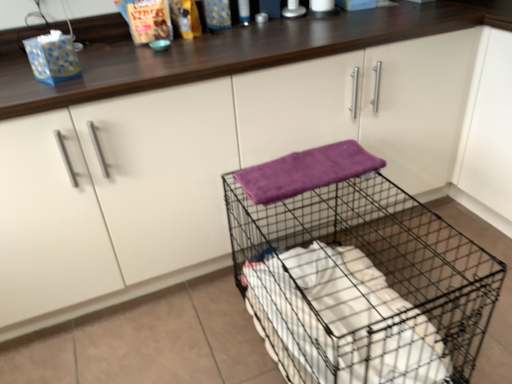
Question: Is the depth of purple soft towel at center greater than that of black wire mesh trolley at center?

Choices:
 (A) yes
 (B) no

Answer: (A)

Question: Is purple soft towel at center located outside black wire mesh trolley at center?

Choices:
 (A) no
 (B) yes

Answer: (B)

Question: From the image's perspective, would you say purple soft towel at center is shown under black wire mesh trolley at center?

Choices:
 (A) no
 (B) yes

Answer: (A)

Question: Is purple soft towel at center in front of black wire mesh trolley at center?

Choices:
 (A) no
 (B) yes

Answer: (A)

Question: Are purple soft towel at center and black wire mesh trolley at center located far from each other?

Choices:
 (A) yes
 (B) no

Answer: (B)

Question: Is black wire mesh trolley at center completely or partially inside purple soft towel at center?

Choices:
 (A) yes
 (B) no

Answer: (B)

Question: Can you confirm if black wire mesh trolley at center is shorter than purple soft towel at center?

Choices:
 (A) yes
 (B) no

Answer: (B)

Question: From a real-world perspective, is black wire mesh trolley at center under purple soft towel at center?

Choices:
 (A) no
 (B) yes

Answer: (B)

Question: Is black wire mesh trolley at center surrounding purple soft towel at center?

Choices:
 (A) yes
 (B) no

Answer: (B)

Question: Is black wire mesh trolley at center at the right side of purple soft towel at center?

Choices:
 (A) yes
 (B) no

Answer: (A)

Question: From a real-world perspective, is black wire mesh trolley at center located higher than purple soft towel at center?

Choices:
 (A) yes
 (B) no

Answer: (B)

Question: Considering the relative positions of black wire mesh trolley at center and purple soft towel at center in the image provided, is black wire mesh trolley at center to the left of purple soft towel at center from the viewer's perspective?

Choices:
 (A) no
 (B) yes

Answer: (A)

Question: In the image, is purple soft towel at center positioned in front of or behind black wire mesh trolley at center?

Choices:
 (A) behind
 (B) front

Answer: (A)